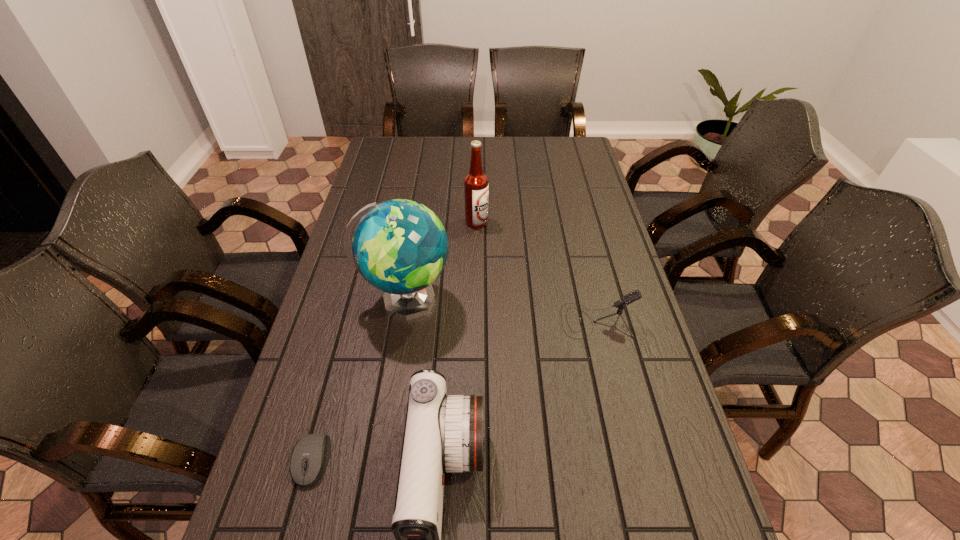
Locate an element on the screen. This screenshot has height=540, width=960. vacant area situated on the back of the computer equipment is located at coordinates (351, 315).

You are a GUI agent. You are given a task and a screenshot of the screen. Output one action in this format:
    pyautogui.click(x=<x>, y=<y>)
    Task: Click on the globe present at the left edge
    This screenshot has width=960, height=540.
    Given the screenshot: What is the action you would take?
    pyautogui.click(x=400, y=247)

Find the location of a particular element. Image resolution: width=960 pixels, height=540 pixels. computer equipment that is at the left edge is located at coordinates (310, 456).

I want to click on object that is at the right edge, so click(x=635, y=295).

Where is `free space at the far edge of the desktop`? The image size is (960, 540). free space at the far edge of the desktop is located at coordinates (484, 164).

In the image, there is a desktop. Identify the location of free space at the left edge. (397, 171).

Find the location of a particular element. free location at the right edge is located at coordinates (577, 179).

Where is `vacant position at the far left corner of the desktop`? vacant position at the far left corner of the desktop is located at coordinates (369, 164).

This screenshot has width=960, height=540. Identify the location of vacant region between the globe and the microphone. [501, 310].

The width and height of the screenshot is (960, 540). I want to click on free point between the globe and the second shortest object, so click(x=501, y=310).